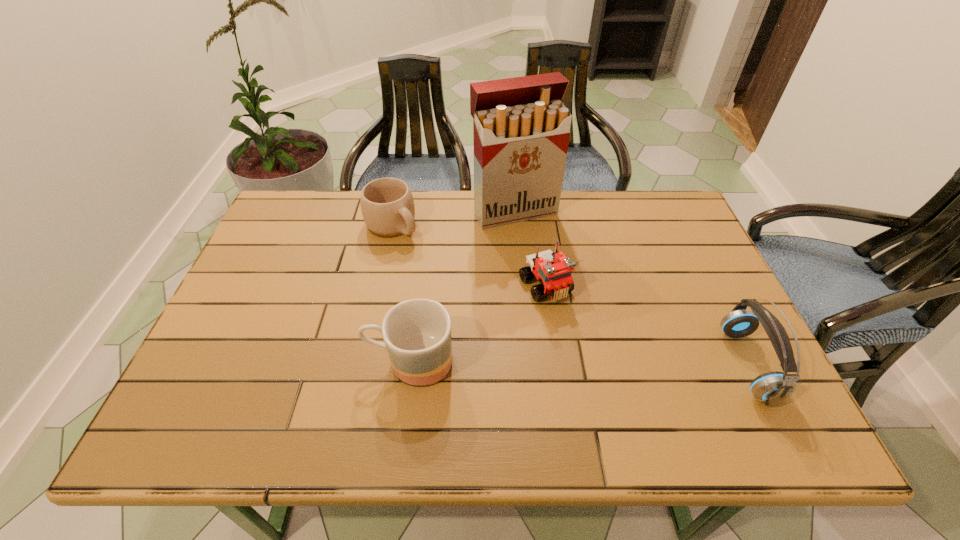
Identify the location of free space located 0.120m on the ear cups of the headset. This screenshot has width=960, height=540. (676, 364).

Where is `free space located on the side of the farther mug with the handle`? This screenshot has height=540, width=960. free space located on the side of the farther mug with the handle is located at coordinates (437, 261).

The width and height of the screenshot is (960, 540). I want to click on vacant area situated 0.240m on the side of the farther mug with the handle, so click(x=463, y=282).

At what (x,y) coordinates should I click in order to perform the action: click on free spot located 0.160m on the side of the farther mug with the handle. Please return your answer as a coordinate pair (x, y). This screenshot has height=540, width=960. Looking at the image, I should click on (444, 266).

Identify the location of free space located on the front-facing side of the third farthest object. (616, 392).

Locate an element on the screen. vacant space located on the front-facing side of the third farthest object is located at coordinates (591, 355).

Where is `free space located 0.090m on the front-facing side of the third farthest object`? free space located 0.090m on the front-facing side of the third farthest object is located at coordinates (576, 333).

Find the location of a particular element. This screenshot has height=540, width=960. free space located with the lid open on the cigarette case is located at coordinates pos(558,277).

Where is `blank area located 0.360m with the lid open on the cigarette case`? blank area located 0.360m with the lid open on the cigarette case is located at coordinates pyautogui.click(x=583, y=319).

I want to click on free spot located with the lid open on the cigarette case, so click(x=542, y=251).